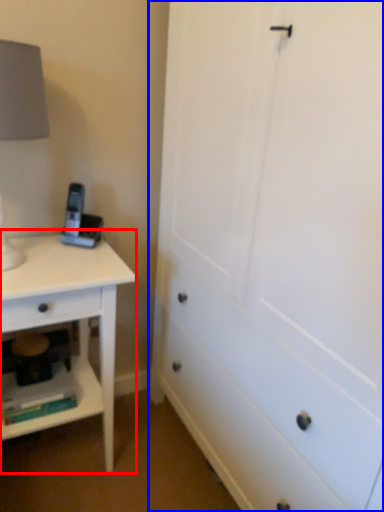
Question: Among these objects, which one is nearest to the camera, nightstand (highlighted by a red box) or chest of drawers (highlighted by a blue box)?

Choices:
 (A) nightstand
 (B) chest of drawers

Answer: (B)